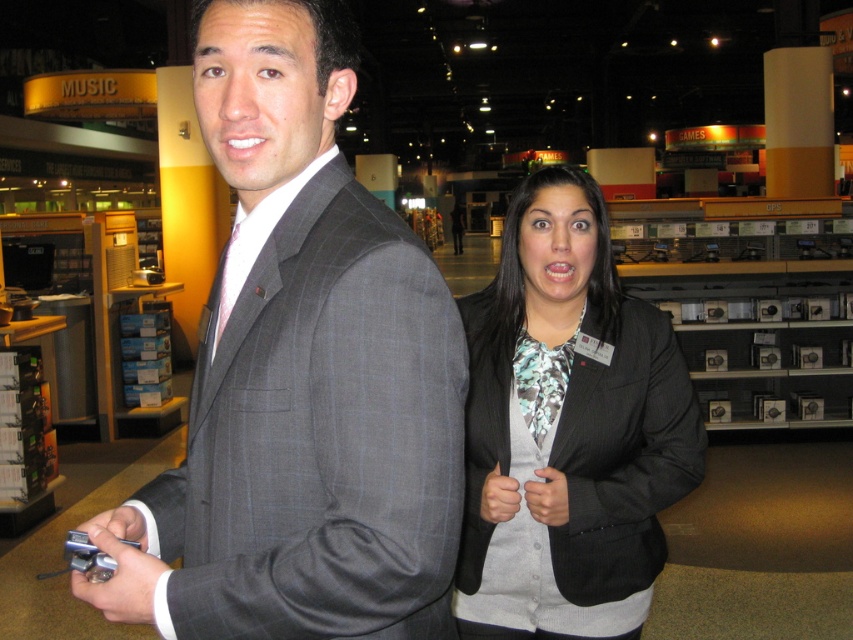
Consider the image. Can you confirm if gray pinstripe suit at center is wider than matte black blazer at center?

No, gray pinstripe suit at center is not wider than matte black blazer at center.

Who is lower down, gray pinstripe suit at center or matte black blazer at center?

matte black blazer at center is below.

Where is `gray pinstripe suit at center`? This screenshot has height=640, width=853. gray pinstripe suit at center is located at coordinates (300, 376).

Identify the location of gray pinstripe suit at center. (300, 376).